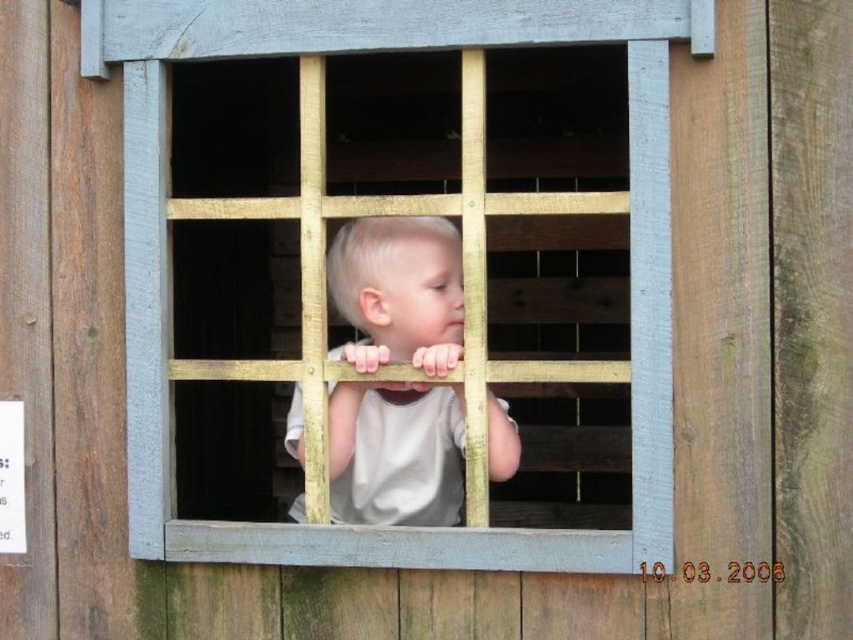
The height and width of the screenshot is (640, 853). What are the coordinates of `wooden bars at center` in the screenshot? It's located at point(392,289).

How distant is wooden bars at center from light beige fabric shirt at center?

A distance of 2.56 inches exists between wooden bars at center and light beige fabric shirt at center.

Is point (663, 268) farther from viewer compared to point (351, 483)?

No, (663, 268) is in front of (351, 483).

Where is `wooden bars at center`? wooden bars at center is located at coordinates (392, 289).